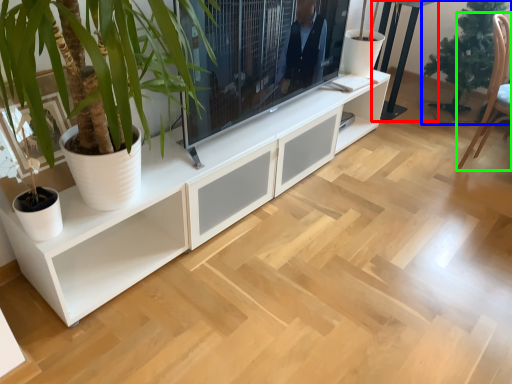
Question: Based on their relative distances, which object is nearer to table (highlighted by a red box)? Choose from houseplant (highlighted by a blue box) and armchair (highlighted by a green box).

Choices:
 (A) houseplant
 (B) armchair

Answer: (A)